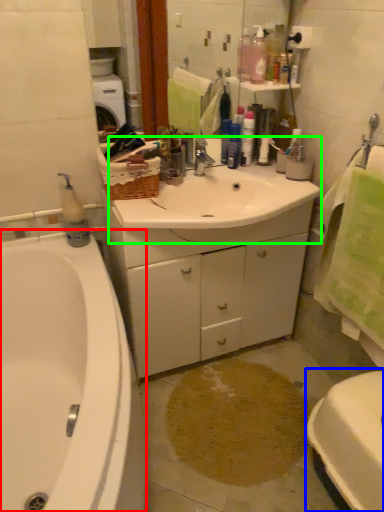
Question: Estimate the real-world distances between objects in this image. Which object is closer to bathtub (highlighted by a red box), toilet (highlighted by a blue box) or sink (highlighted by a green box)?

Choices:
 (A) toilet
 (B) sink

Answer: (B)